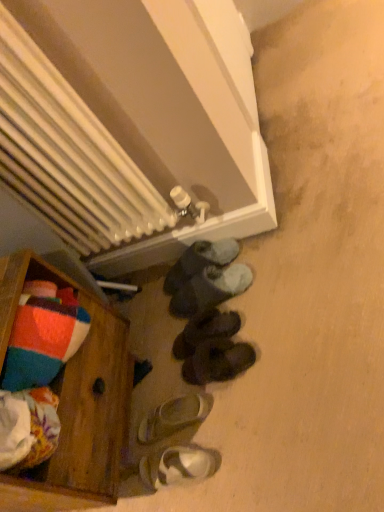
The image size is (384, 512). Find the location of `free space to the right of white matte sandals at lower center, arranged as the 1th footwear when ordered from the bottom`. free space to the right of white matte sandals at lower center, arranged as the 1th footwear when ordered from the bottom is located at coordinates point(225,431).